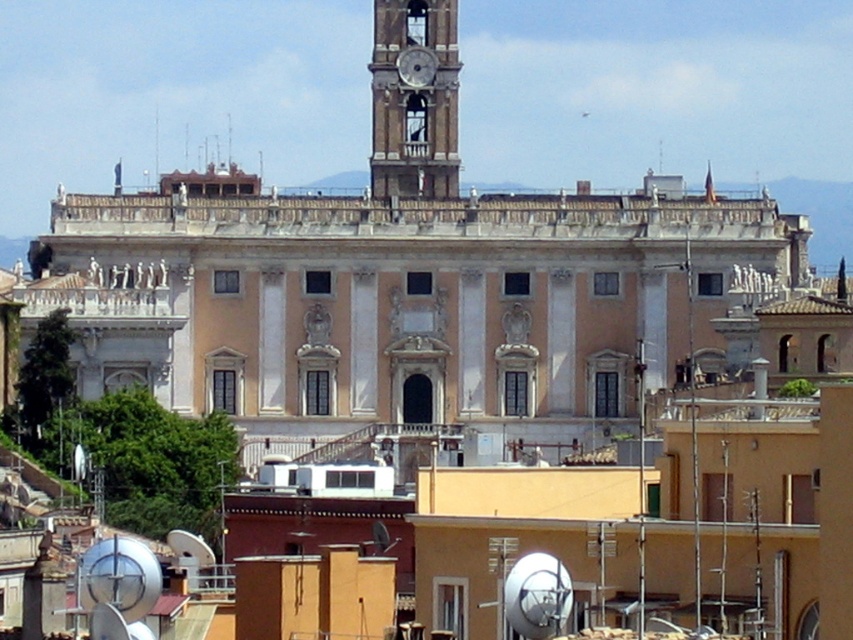
Which of these two, smooth stone clock tower at center or metallic silver clock at upper center, stands taller?

smooth stone clock tower at center

Is smooth stone clock tower at center bigger than metallic silver clock at upper center?

Correct, smooth stone clock tower at center is larger in size than metallic silver clock at upper center.

Is point (425, 182) less distant than point (408, 84)?

Yes.

Locate an element on the screen. Image resolution: width=853 pixels, height=640 pixels. smooth stone clock tower at center is located at coordinates (415, 99).